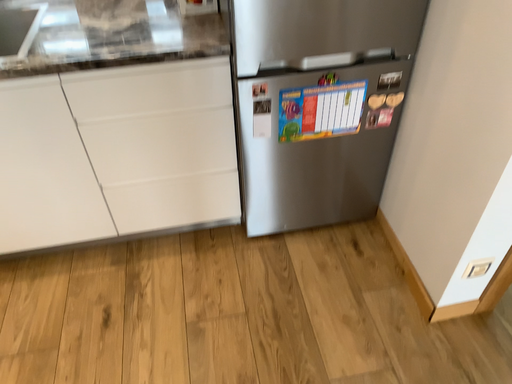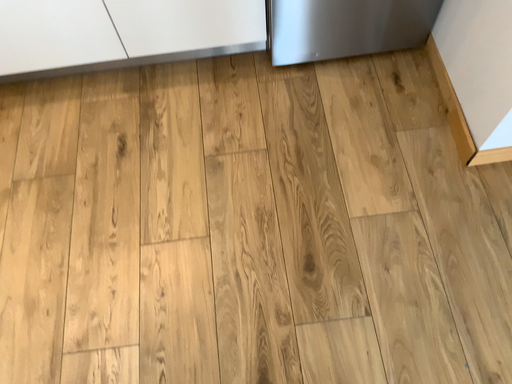
Question: How did the camera likely rotate when shooting the video?

Choices:
 (A) rotated upward
 (B) rotated downward

Answer: (B)